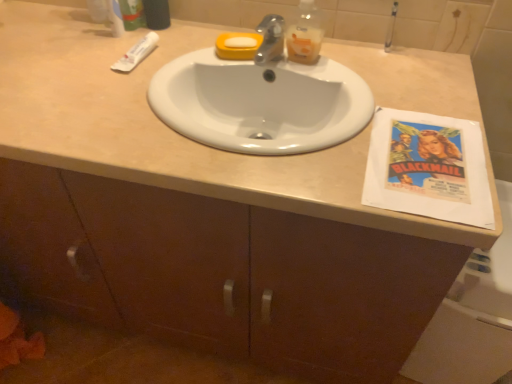
At what (x,y) coordinates should I click in order to perform the action: click on free location in front of white matte tube at upper left. Please return your answer as a coordinate pair (x, y). The image size is (512, 384). Looking at the image, I should click on [x=110, y=93].